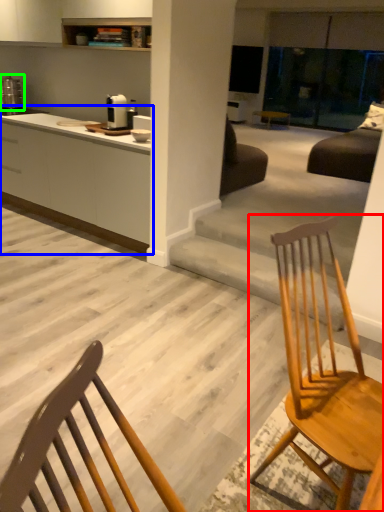
Question: Estimate the real-world distances between objects in this image. Which object is farther from chair (highlighted by a red box), cabinetry (highlighted by a blue box) or appliance (highlighted by a green box)?

Choices:
 (A) cabinetry
 (B) appliance

Answer: (B)